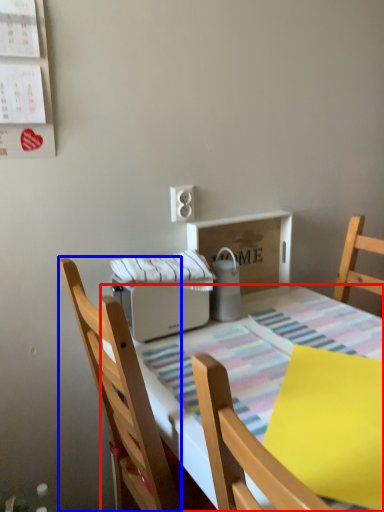
Question: Which point is closer to the camera, kitchen & dining room table (highlighted by a red box) or chair (highlighted by a blue box)?

Choices:
 (A) kitchen & dining room table
 (B) chair

Answer: (A)